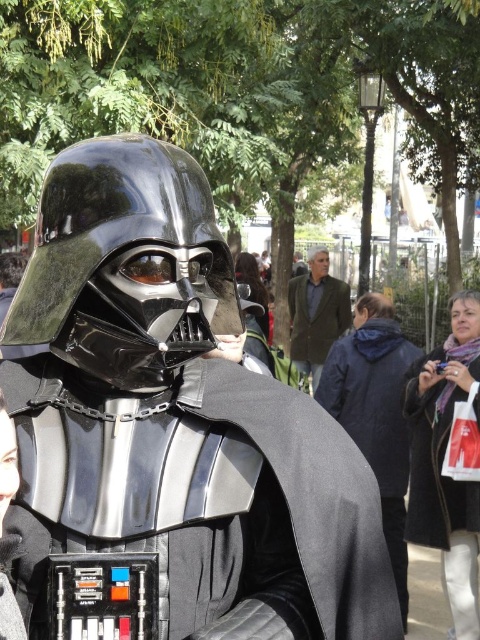
Question: Does black matte scarf at lower right appear over green textured jacket at center?

Choices:
 (A) yes
 (B) no

Answer: (B)

Question: Which point is farther to the camera?

Choices:
 (A) pyautogui.click(x=0, y=369)
 (B) pyautogui.click(x=87, y=221)
 (C) pyautogui.click(x=397, y=392)
 (D) pyautogui.click(x=333, y=282)

Answer: (D)

Question: Among these points, which one is farthest from the camera?

Choices:
 (A) (416, 536)
 (B) (314, 396)
 (C) (50, 339)

Answer: (B)

Question: Is glossy black armor at center smaller than black matte scarf at lower right?

Choices:
 (A) no
 (B) yes

Answer: (B)

Question: Where is glossy black armor at center located in relation to black matte cape at center in the image?

Choices:
 (A) right
 (B) left

Answer: (B)

Question: Which point is farther to the camera?

Choices:
 (A) black matte cape at center
 (B) glossy black helmet at center
 (C) glossy black armor at center
 (D) black matte scarf at lower right

Answer: (A)